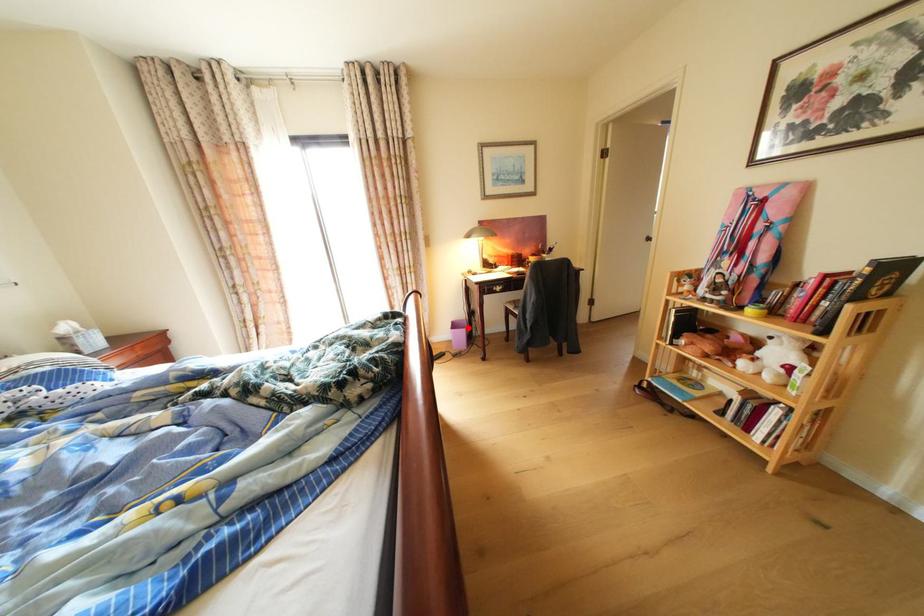
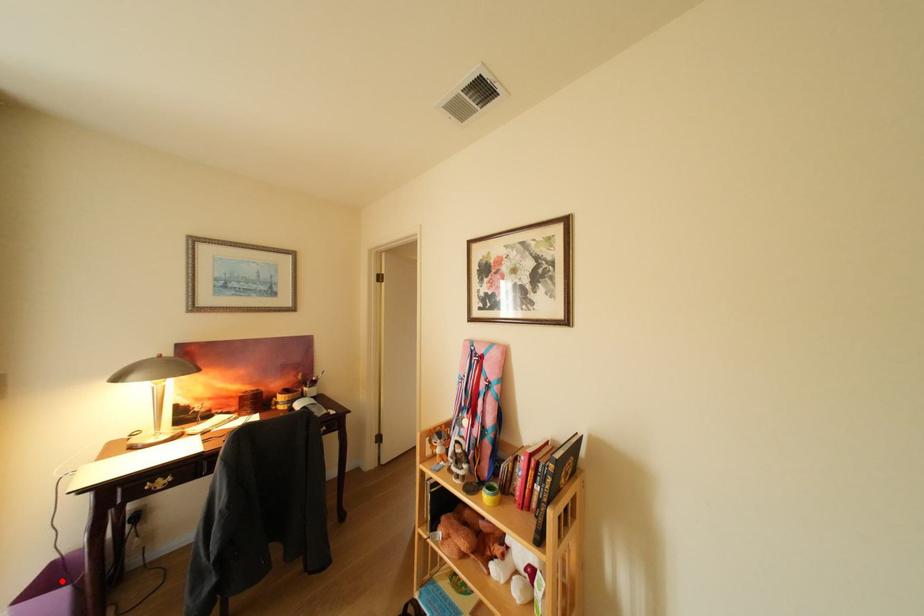
I am providing you with two images of the same scene from different viewpoints. A red point is marked on the first image and another point is marked on the second image. Do the highlighted points in image1 and image2 indicate the same real-world spot?

Yes